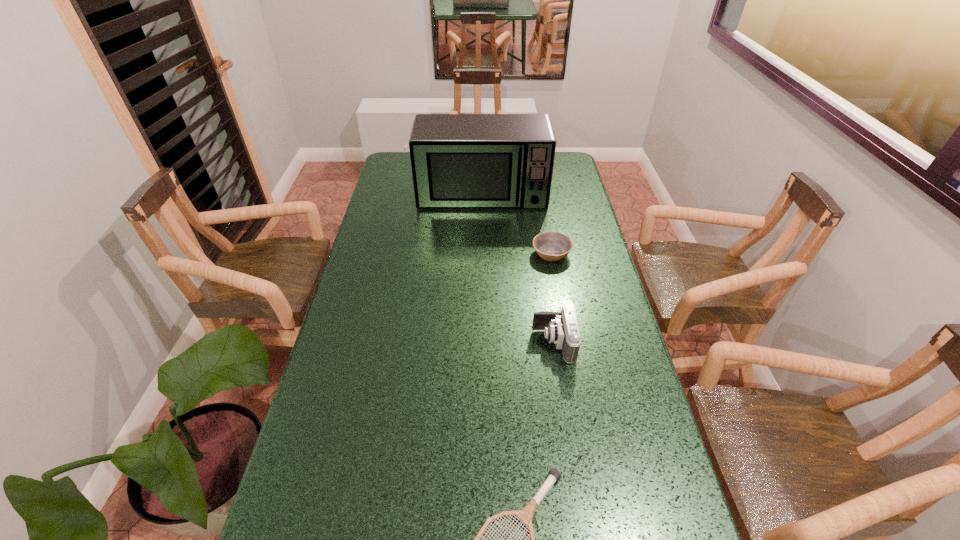
The image size is (960, 540). Identify the location of microwave_oven. (458, 160).

This screenshot has height=540, width=960. Find the location of `the farthest object`. the farthest object is located at coordinates (458, 160).

You are a GUI agent. You are given a task and a screenshot of the screen. Output one action in this format:
    pyautogui.click(x=<x>, y=<y>)
    Task: Click on the camera
    
    Given the screenshot: What is the action you would take?
    pyautogui.click(x=562, y=329)

Where is `the second tallest object`? the second tallest object is located at coordinates (562, 329).

Identify the location of bowl. (551, 246).

Image resolution: width=960 pixels, height=540 pixels. Find the location of `the third tallest object`. the third tallest object is located at coordinates (551, 246).

This screenshot has width=960, height=540. In order to click on vacant space located on the front-facing side of the microwave_oven in this screenshot , I will do `click(483, 262)`.

Where is `vacant area situated at the front of the third farthest object with an open lens cover`? This screenshot has width=960, height=540. vacant area situated at the front of the third farthest object with an open lens cover is located at coordinates (488, 342).

This screenshot has height=540, width=960. I want to click on free space located at the front of the third farthest object with an open lens cover, so click(x=436, y=342).

Find the location of a particular element. The image size is (960, 540). vacant area located 0.170m at the front of the third farthest object with an open lens cover is located at coordinates (474, 342).